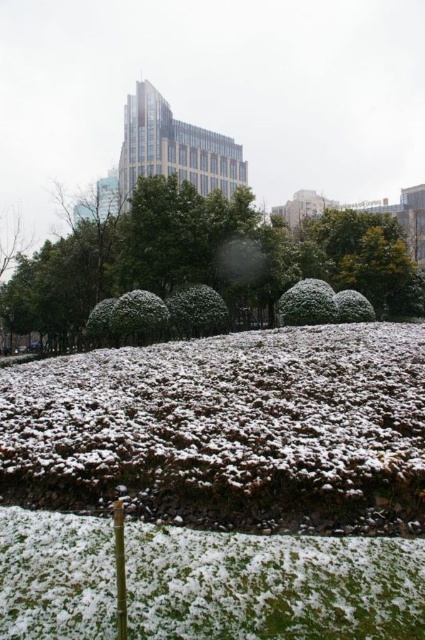
Between green grassy patch at lower center and snow-covered bush at center, which one is positioned lower?

Positioned lower is green grassy patch at lower center.

Does point (130, 608) come closer to viewer compared to point (288, 312)?

Yes, point (130, 608) is closer to viewer.

The image size is (425, 640). Find the location of `green grassy patch at lower center`. green grassy patch at lower center is located at coordinates (272, 586).

Identify the location of green grassy patch at lower center. The height and width of the screenshot is (640, 425). (272, 586).

Does green grassy patch at lower center have a smaller size compared to green textured bush at center?

Yes, green grassy patch at lower center is smaller than green textured bush at center.

Is point (331, 630) closer to viewer compared to point (149, 202)?

Yes, it is in front of point (149, 202).

The height and width of the screenshot is (640, 425). In order to click on green grassy patch at lower center in this screenshot , I will do `click(272, 586)`.

Does green textured bush at center appear on the right side of snow-covered bush at center?

Incorrect, green textured bush at center is not on the right side of snow-covered bush at center.

Describe the element at coordinates (204, 259) in the screenshot. The width and height of the screenshot is (425, 640). I see `green textured bush at center` at that location.

Describe the element at coordinates (204, 259) in the screenshot. The height and width of the screenshot is (640, 425). I see `green textured bush at center` at that location.

Identify the location of green textured bush at center. The height and width of the screenshot is (640, 425). (204, 259).